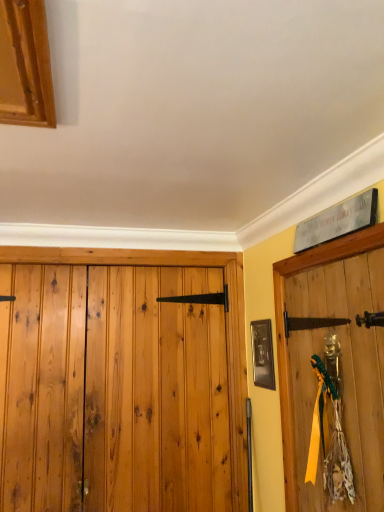
Locate an element on the screen. The image size is (384, 512). wooden framed picture at center is located at coordinates (262, 354).

What is the approximate width of wooden framed picture at center?

It is 0.70 inches.

This screenshot has width=384, height=512. What do you see at coordinates (262, 354) in the screenshot?
I see `wooden framed picture at center` at bounding box center [262, 354].

What are the coordinates of `wooden framed picture at center` in the screenshot? It's located at (262, 354).